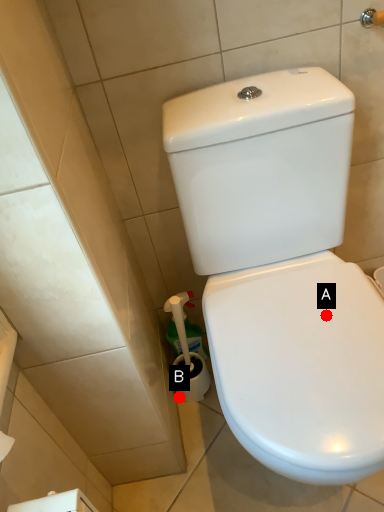
Question: Two points are circled on the image, labeled by A and B beside each circle. Among these points, which one is nearest to the camera?

Choices:
 (A) A is closer
 (B) B is closer

Answer: (A)